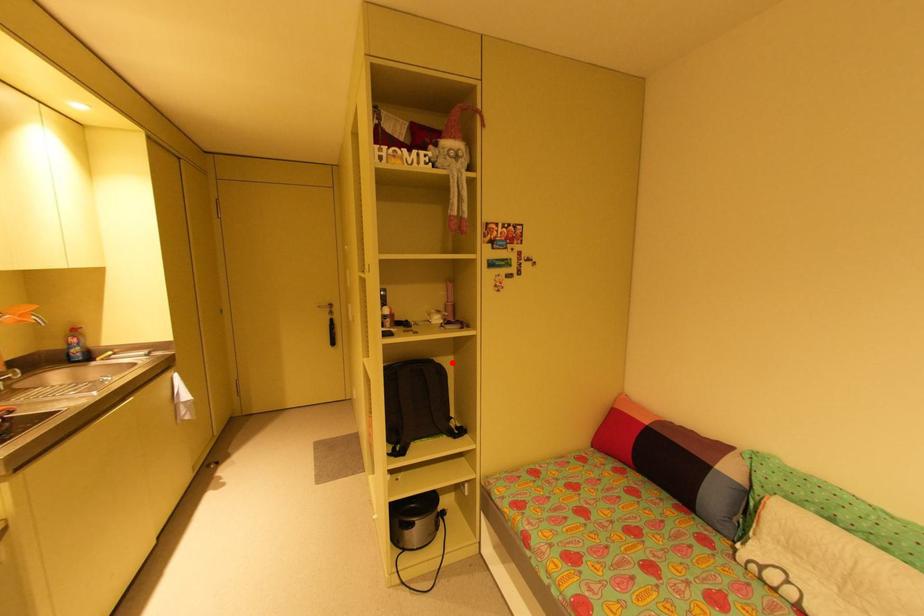
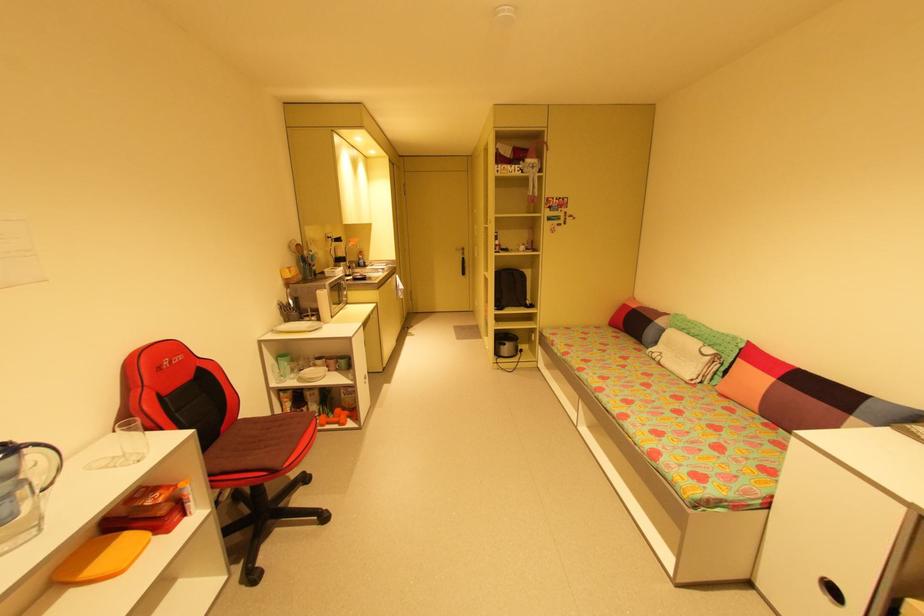
The point at the highlighted location is marked in the first image. Where is the corresponding point in the second image?

(532, 273)